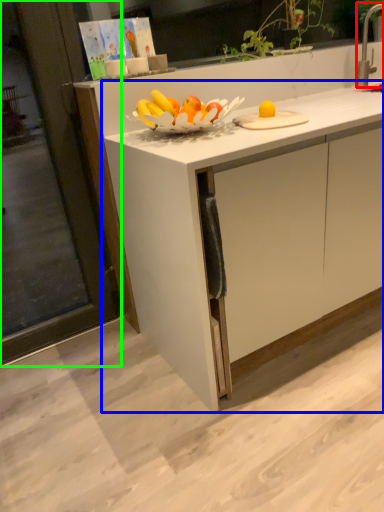
Question: Which object is the closest to the faucet (highlighted by a red box)? Choose among these: cabinetry (highlighted by a blue box) or screen door (highlighted by a green box).

Choices:
 (A) cabinetry
 (B) screen door

Answer: (A)